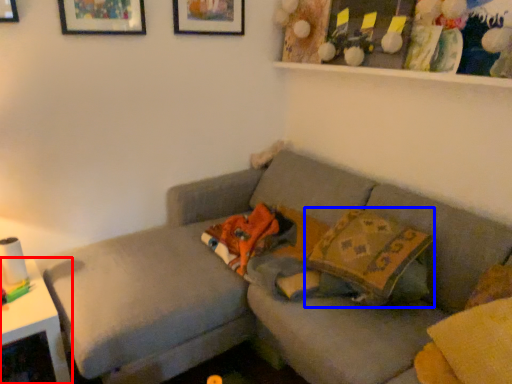
Question: Among these objects, which one is farthest to the camera, table (highlighted by a red box) or throw pillow (highlighted by a blue box)?

Choices:
 (A) table
 (B) throw pillow

Answer: (B)